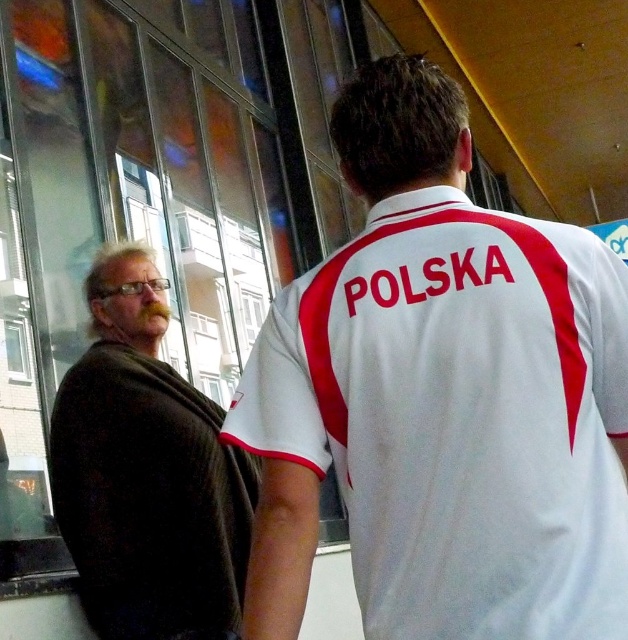
Can you confirm if white fabric shirt at center is smaller than dark brown sweater at left?

Indeed, white fabric shirt at center has a smaller size compared to dark brown sweater at left.

The height and width of the screenshot is (640, 628). Find the location of `white fabric shirt at center`. white fabric shirt at center is located at coordinates (441, 397).